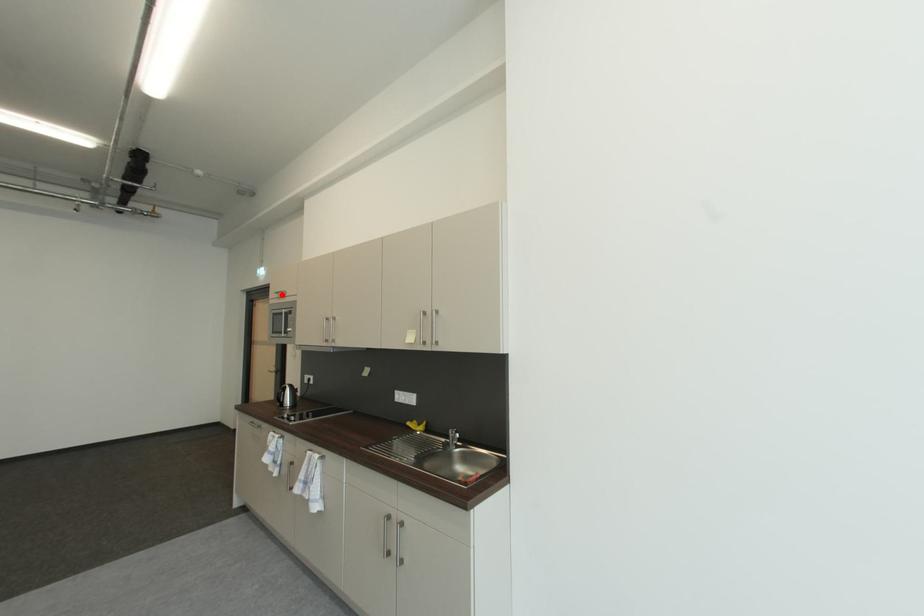
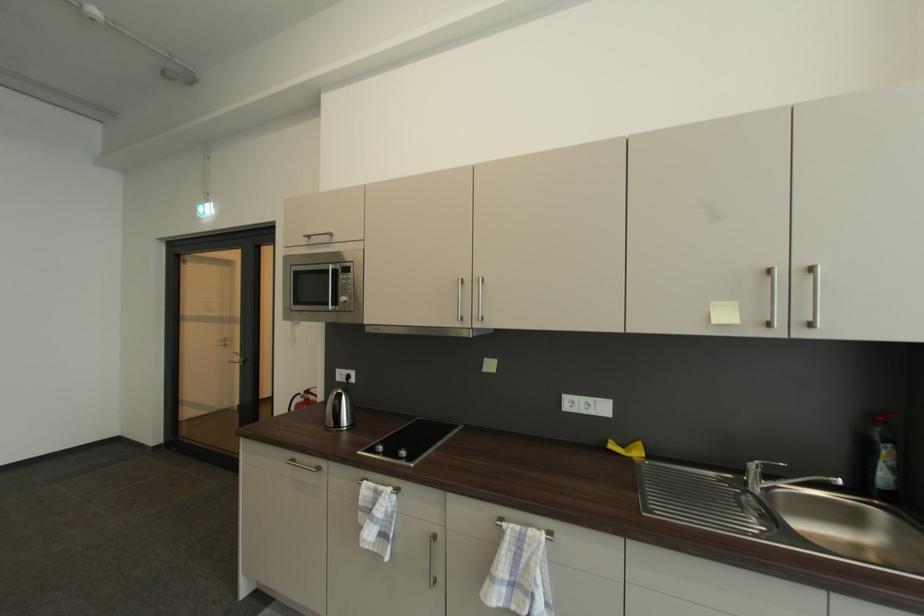
The point at the highlighted location is marked in the first image. Where is the corresponding point in the second image?

(311, 237)